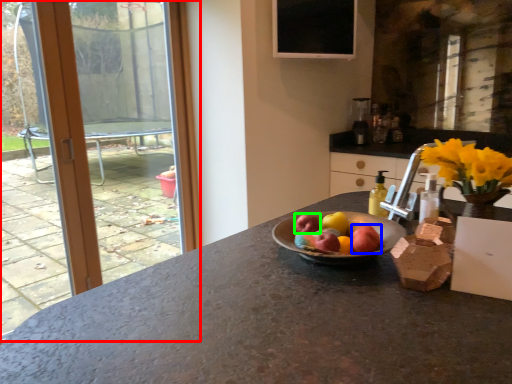
Question: Which object is the farthest from window (highlighted by a red box)? Choose among these: apple (highlighted by a blue box) or apple (highlighted by a green box).

Choices:
 (A) apple
 (B) apple

Answer: (A)